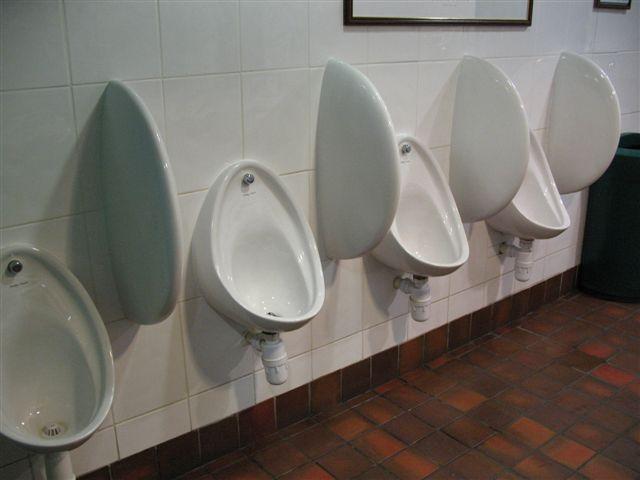
Locate an element on the screen. urinals is located at coordinates (45, 350), (253, 266), (408, 224), (524, 203).